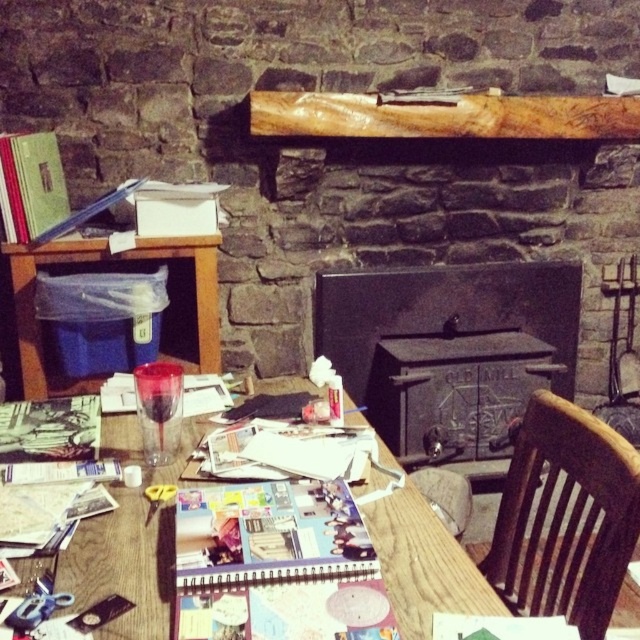
You are trying to decide whether to place a large potted plant on the brown wooden chair at lower right or the wooden plank at upper center. Based on their sizes, which surface is more suitable for the plant?

The brown wooden chair at lower right is larger in size than the wooden plank at upper center, so the brown wooden chair at lower right can better accommodate the large potted plant.

You are sitting in the brown wooden chair at lower right and want to reach the wooden plank at upper center to grab a pen. Can you easily reach it while staying seated?

The brown wooden chair at lower right is closer to the viewer than the wooden plank at upper center, so there is a distance between them. You might need to stretch or move closer to reach the wooden plank at upper center while seated.